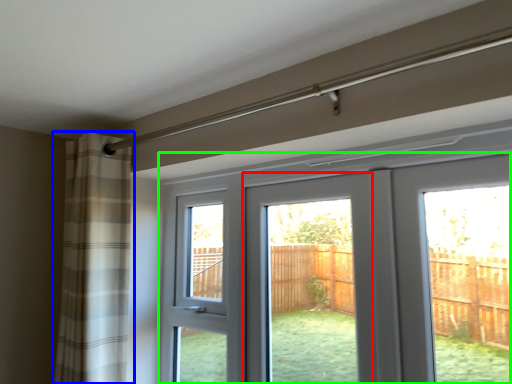
Question: Which object is positioned farthest from screen door (highlighted by a red box)? Select from curtain (highlighted by a blue box) and door (highlighted by a green box).

Choices:
 (A) curtain
 (B) door

Answer: (B)